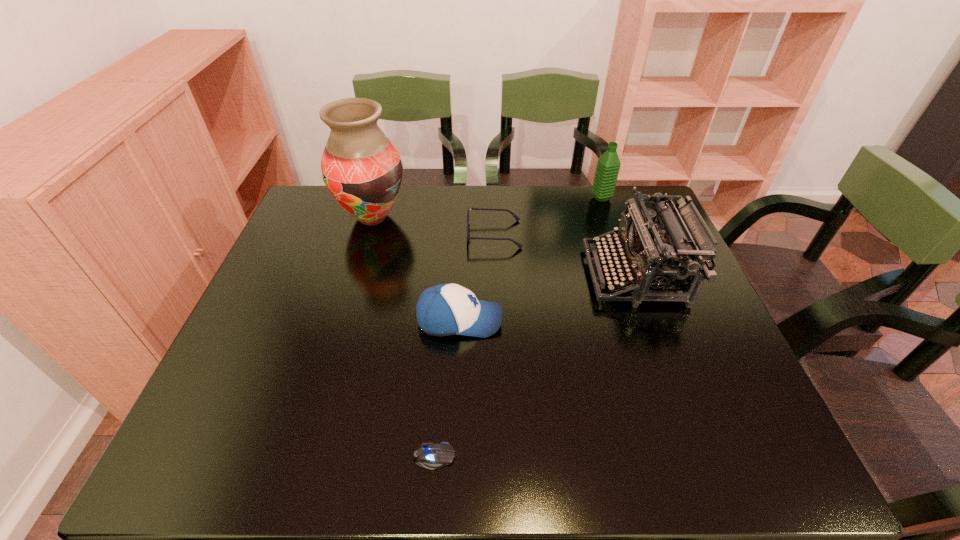
At what (x,y) coordinates should I click in order to perform the action: click on vase. Please return your answer as a coordinate pair (x, y). The height and width of the screenshot is (540, 960). Looking at the image, I should click on (361, 168).

Find the location of a particular element. The height and width of the screenshot is (540, 960). the leftmost object is located at coordinates (361, 168).

Locate an element on the screen. The image size is (960, 540). water bottle is located at coordinates (608, 165).

Locate an element on the screen. This screenshot has width=960, height=540. typewriter is located at coordinates (657, 259).

Where is `the fourth tallest object`? The height and width of the screenshot is (540, 960). the fourth tallest object is located at coordinates (447, 309).

Locate an element on the screen. the fifth tallest object is located at coordinates (516, 217).

Image resolution: width=960 pixels, height=540 pixels. Find the location of `computer mouse`. computer mouse is located at coordinates tap(430, 456).

Where is `the shortest object`? This screenshot has height=540, width=960. the shortest object is located at coordinates (430, 456).

Identify the location of vacant area situated 0.310m on the front of the vase. The height and width of the screenshot is (540, 960). (342, 321).

Identify the location of free space located 0.340m on the front of the water bottle. (629, 276).